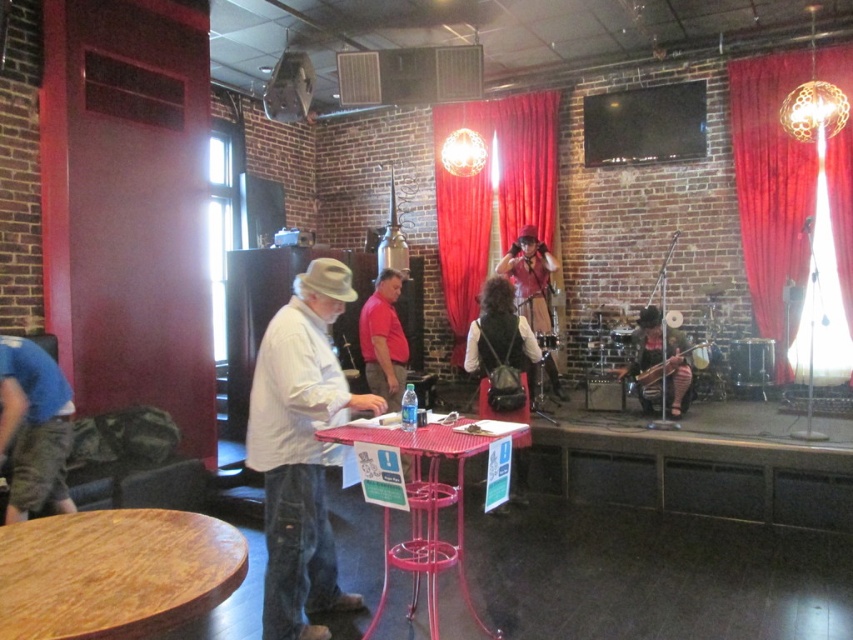
Can you confirm if metallic pink table at center is thinner than wooden drum at center?

No, metallic pink table at center is not thinner than wooden drum at center.

Can you confirm if metallic pink table at center is positioned to the right of wooden drum at center?

No, metallic pink table at center is not to the right of wooden drum at center.

Which is behind, point (369, 627) or point (672, 365)?

The point (672, 365) is more distant.

This screenshot has width=853, height=640. I want to click on metallic pink table at center, so click(x=424, y=512).

Who is more distant from viewer, (514,356) or (695,365)?

Positioned behind is point (695,365).

Can you confirm if leather vest at center is positioned to the right of wooden acoustic guitar at center?

In fact, leather vest at center is to the left of wooden acoustic guitar at center.

Is point (520, 349) closer to camera compared to point (642, 384)?

Yes, point (520, 349) is closer to viewer.

I want to click on leather vest at center, so click(500, 353).

Which of these two, wooden table at lower left or red velvet curtain at upper right, stands shorter?

With less height is wooden table at lower left.

Based on the photo, which is above, wooden table at lower left or red velvet curtain at upper right?

red velvet curtain at upper right

This screenshot has width=853, height=640. What do you see at coordinates (114, 572) in the screenshot? I see `wooden table at lower left` at bounding box center [114, 572].

This screenshot has height=640, width=853. Find the location of `wooden table at lower left`. wooden table at lower left is located at coordinates (114, 572).